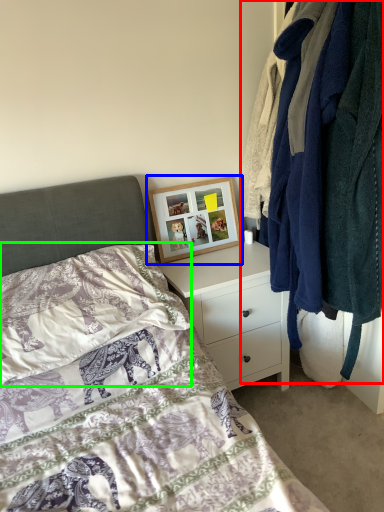
Question: Which is nearer to the closet (highlighted by a red box)? picture frame (highlighted by a blue box) or pillow (highlighted by a green box).

Choices:
 (A) picture frame
 (B) pillow

Answer: (A)